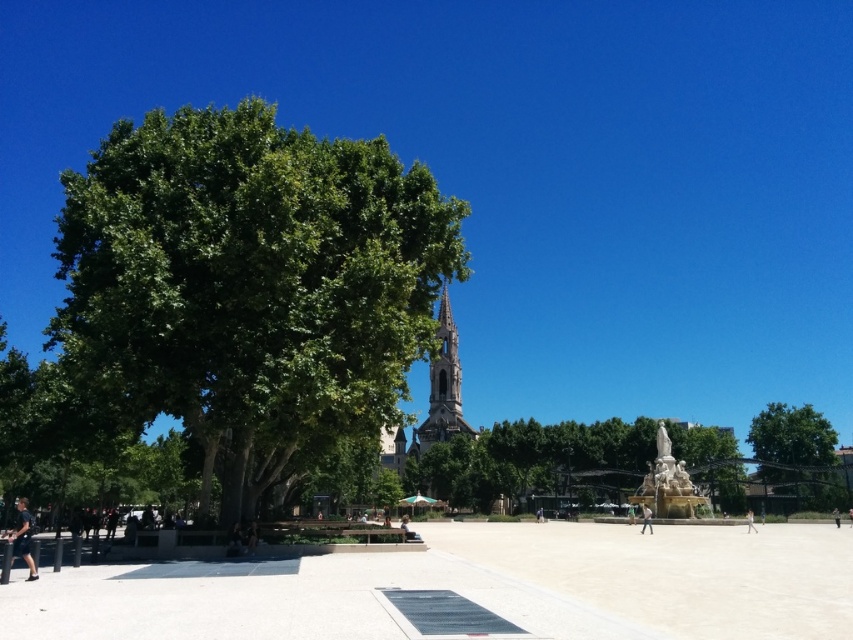
Based on the photo, is green leafy tree at left wider than dark blue jeans at lower center?

Correct, the width of green leafy tree at left exceeds that of dark blue jeans at lower center.

Between green leafy tree at left and dark blue jeans at lower center, which one appears on the right side from the viewer's perspective?

Positioned to the right is green leafy tree at left.

Where is `green leafy tree at left`? The image size is (853, 640). green leafy tree at left is located at coordinates (251, 284).

Is green leafy tree at right taller than dark blue jeans at lower center?

Yes.

Measure the distance between green leafy tree at right and dark blue jeans at lower center.

A distance of 85.72 meters exists between green leafy tree at right and dark blue jeans at lower center.

Who is more forward, [825,460] or [247,541]?

Point [247,541]

At what (x,y) coordinates should I click in order to perform the action: click on green leafy tree at right. Please return your answer as a coordinate pair (x, y). This screenshot has height=640, width=853. Looking at the image, I should click on (793, 456).

From the picture: Is green leafy tree at left smaller than smooth stone tower at center?

Indeed, green leafy tree at left has a smaller size compared to smooth stone tower at center.

What do you see at coordinates (251, 284) in the screenshot? I see `green leafy tree at left` at bounding box center [251, 284].

Identify the location of green leafy tree at left. (251, 284).